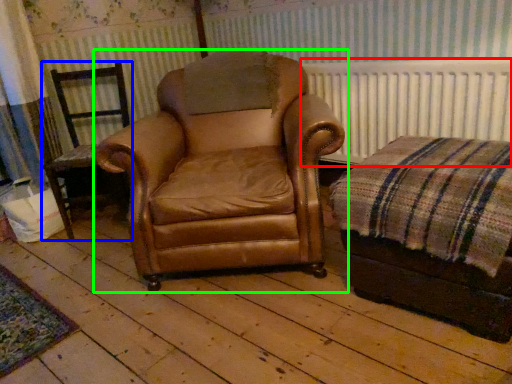
Question: Which is nearer to the radiator (highlighted by a red box)? chair (highlighted by a blue box) or chair (highlighted by a green box).

Choices:
 (A) chair
 (B) chair

Answer: (B)